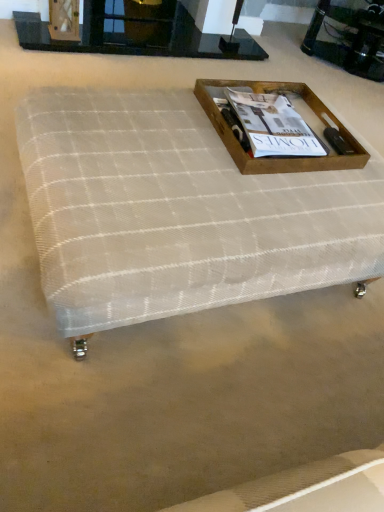
What are the coordinates of `vacant area situated to the left side of matte brown wooden tray at upper center` in the screenshot? It's located at (172, 123).